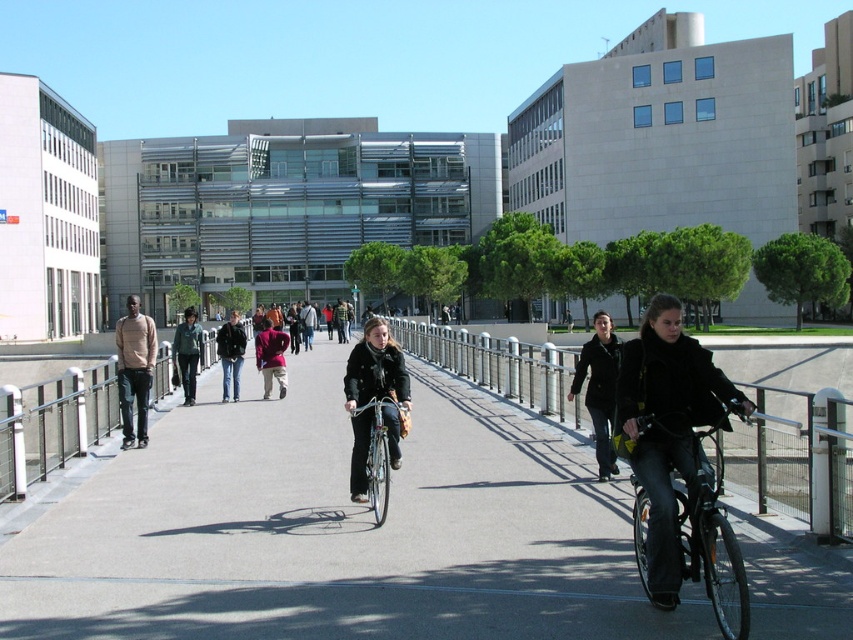
In the scene shown: You are a pedestrian walking on the pathway and want to pass between the shiny black bicycle at center and the dark brown leather jacket at center. Which direction should you move to go around them?

To pass between the shiny black bicycle at center and the dark brown leather jacket at center, you should move to the left side of the dark brown leather jacket at center since the shiny black bicycle at center is on the right side of it.

You are standing on the sidewalk and want to take a photo of the shiny black bicycle at center. If your camera has a minimum focus distance of 4 meters, will you be able to take a clear photo without moving closer?

The shiny black bicycle at center is 4.30 meters away from the viewer. Since the camera requires a minimum focus distance of 4 meters, the bicycle is just within the range, so you can take a clear photo without moving closer.

You are a delivery person needing to place a large package on the ground. The package is too big to carry while riding your silver metallic bicycle at center. Where should you place it so it stays on the concrete pavement at center and doesn t fall off?

The concrete pavement at center has a larger size compared to silver metallic bicycle at center, so you can place the package on the concrete pavement at center since it has enough space to hold the large package without it falling off.